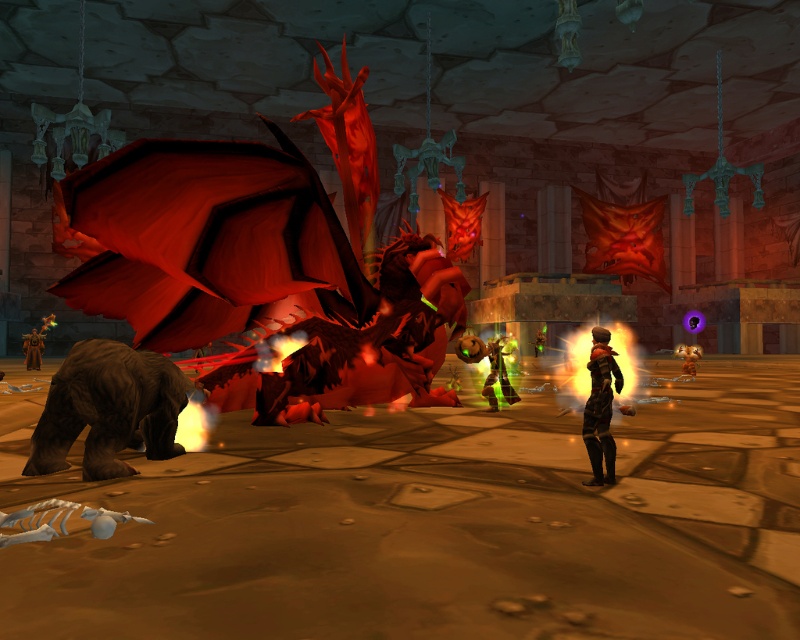
Does point (590, 452) come closer to viewer compared to point (502, 371)?

Yes.

Does dark brown leather armor at center have a lesser width compared to green metallic armor at center?

Correct, dark brown leather armor at center's width is less than green metallic armor at center's.

Image resolution: width=800 pixels, height=640 pixels. What do you see at coordinates (600, 406) in the screenshot?
I see `dark brown leather armor at center` at bounding box center [600, 406].

You are a GUI agent. You are given a task and a screenshot of the screen. Output one action in this format:
    pyautogui.click(x=<x>, y=<y>)
    Task: Click on the dark brown leather armor at center
    
    Given the screenshot: What is the action you would take?
    pyautogui.click(x=600, y=406)

Is dark brown leather armor at center positioned before brown leather armor at center?

That is True.

Between dark brown leather armor at center and brown leather armor at center, which one appears on the left side from the viewer's perspective?

Positioned to the left is brown leather armor at center.

Who is more distant from viewer, (602, 456) or (36, 360)?

The point (36, 360) is behind.

At what (x,y) coordinates should I click in order to perform the action: click on dark brown leather armor at center. Please return your answer as a coordinate pair (x, y). This screenshot has height=640, width=800. Looking at the image, I should click on (600, 406).

Who is higher up, green metallic armor at center or brown leather armor at center?

green metallic armor at center is above.

Between point (498, 371) and point (36, 330), which one is positioned behind?

Positioned behind is point (36, 330).

In the scene shown: Who is more forward, [508,353] or [42,340]?

Positioned in front is point [508,353].

Where is `green metallic armor at center`? The width and height of the screenshot is (800, 640). green metallic armor at center is located at coordinates (498, 376).